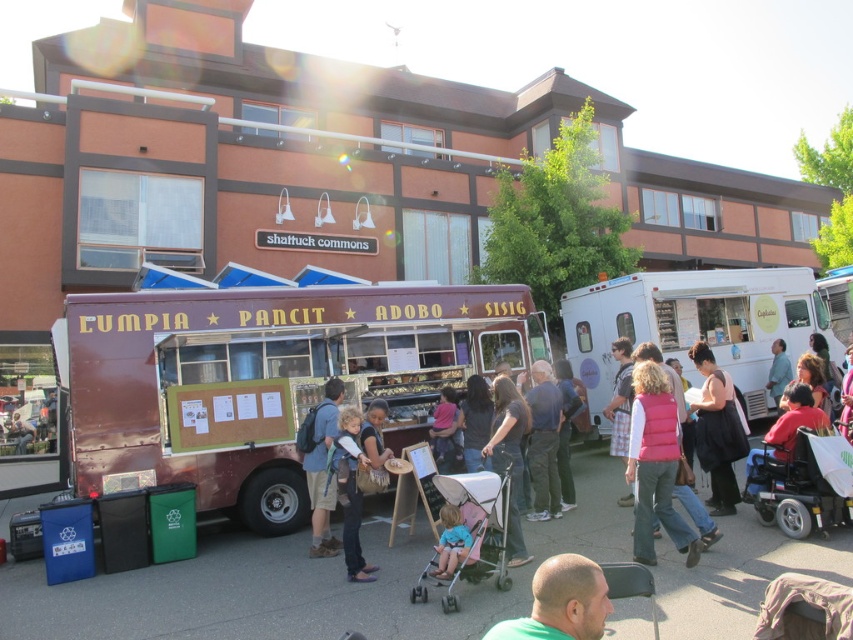
Does denim shorts at center have a greater height compared to matte black backpack at center?

Correct, denim shorts at center is much taller as matte black backpack at center.

Who is more distant from viewer, (332, 493) or (28, 420)?

The point (28, 420) is behind.

Locate an element on the screen. denim shorts at center is located at coordinates (322, 470).

In the scene shown: How much distance is there between white glossy food truck at right and denim pants at center?

6.64 meters

Which of these two, white glossy food truck at right or denim pants at center, stands shorter?

With less height is white glossy food truck at right.

Is point (686, 294) behind point (352, 477)?

Yes, it is behind point (352, 477).

Identify the location of white glossy food truck at right. click(x=694, y=324).

Does pink fabric baby carriage at center have a greater height compared to light blue shirt at center?

No.

Is point (485, 536) farther from camera compared to point (773, 385)?

That is False.

Identify the location of pink fabric baby carriage at center. The width and height of the screenshot is (853, 640). pos(471,532).